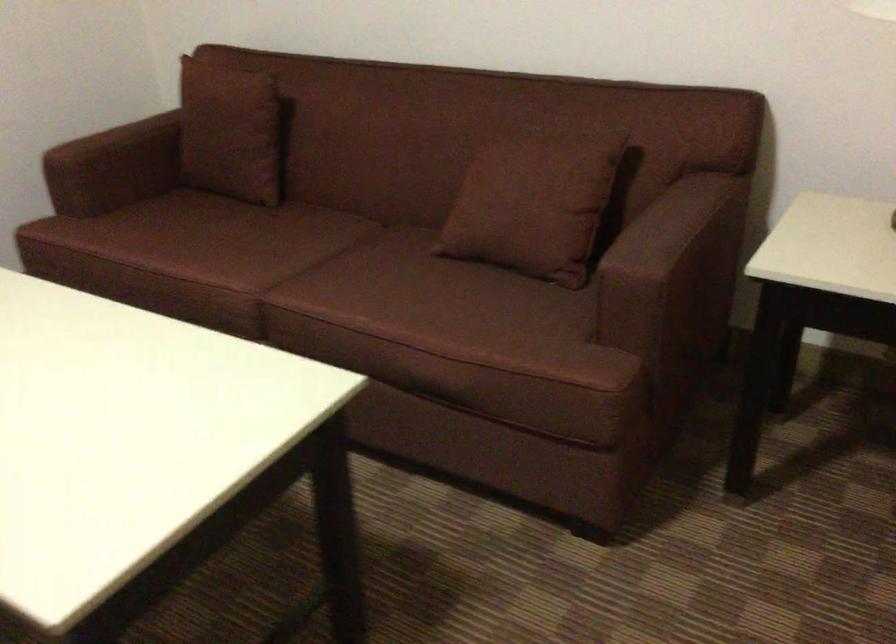
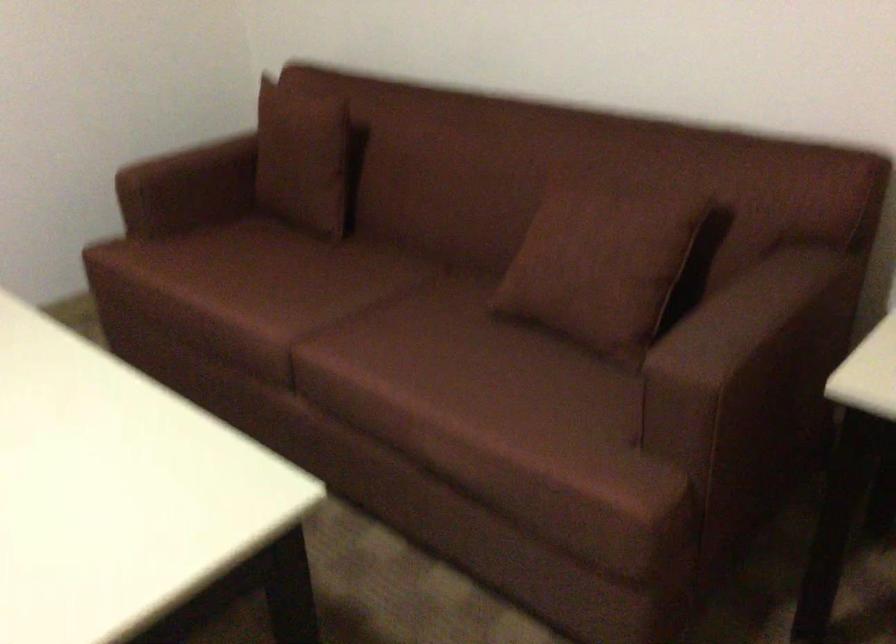
Locate, in the second image, the point that corresponds to pixel 170 140 in the first image.

(246, 165)